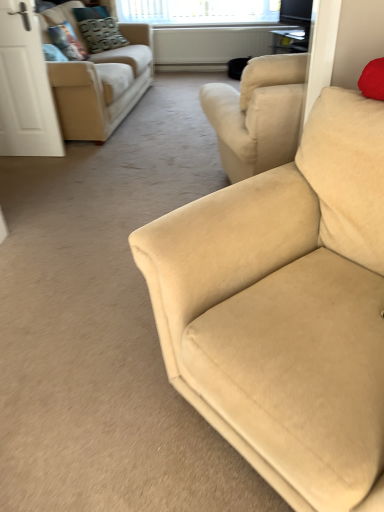
Question: Is beige fabric couch at upper left, the 1th studio couch viewed from the top, thinner than white matte door at left?

Choices:
 (A) yes
 (B) no

Answer: (B)

Question: Considering the relative positions of beige fabric couch at upper left, the 1th studio couch from the back, and white matte door at left in the image provided, is beige fabric couch at upper left, the 1th studio couch from the back, to the right of white matte door at left from the viewer's perspective?

Choices:
 (A) no
 (B) yes

Answer: (B)

Question: Is beige fabric couch at upper left, the 1th studio couch from the left, positioned before white matte door at left?

Choices:
 (A) no
 (B) yes

Answer: (A)

Question: From the image's perspective, is beige fabric couch at upper left, the 1th studio couch viewed from the top, above white matte door at left?

Choices:
 (A) no
 (B) yes

Answer: (B)

Question: Is beige fabric couch at upper left, the 1th studio couch from the back, not inside white matte door at left?

Choices:
 (A) no
 (B) yes

Answer: (B)

Question: From the image's perspective, is beige fabric couch at upper left, the 1th studio couch from the left, under white matte door at left?

Choices:
 (A) yes
 (B) no

Answer: (B)

Question: From the image's perspective, does white matte door at left appear higher than beige fabric couch at right, which is the 1th studio couch from bottom to top?

Choices:
 (A) yes
 (B) no

Answer: (A)

Question: Is white matte door at left positioned far away from beige fabric couch at right, which is the 1th studio couch from bottom to top?

Choices:
 (A) no
 (B) yes

Answer: (B)

Question: Is white matte door at left taller than beige fabric couch at right, which is the 1th studio couch from bottom to top?

Choices:
 (A) yes
 (B) no

Answer: (A)

Question: Is beige fabric couch at right, placed as the second studio couch when sorted from top to bottom, at the back of white matte door at left?

Choices:
 (A) yes
 (B) no

Answer: (B)

Question: Considering the relative sizes of white matte door at left and beige fabric couch at right, the first studio couch in the front-to-back sequence, in the image provided, is white matte door at left smaller than beige fabric couch at right, the first studio couch in the front-to-back sequence,?

Choices:
 (A) no
 (B) yes

Answer: (B)

Question: Does white matte door at left have a lesser width compared to beige fabric couch at right, placed as the second studio couch when sorted from top to bottom?

Choices:
 (A) no
 (B) yes

Answer: (B)

Question: From a real-world perspective, is velvet textured pillow at upper left, the first pillow positioned from the back, on clear glass window at upper center?

Choices:
 (A) yes
 (B) no

Answer: (B)